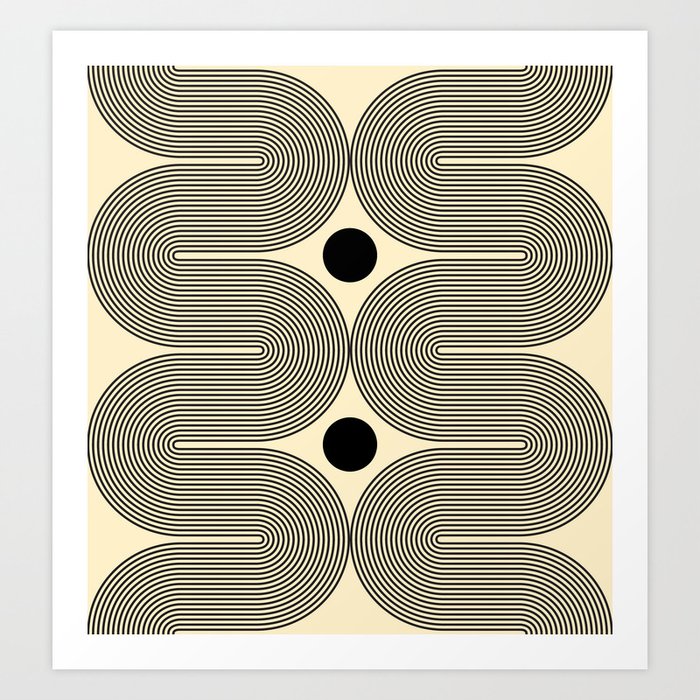
Where is `show piece`? The image size is (700, 700). show piece is located at coordinates (509, 455).